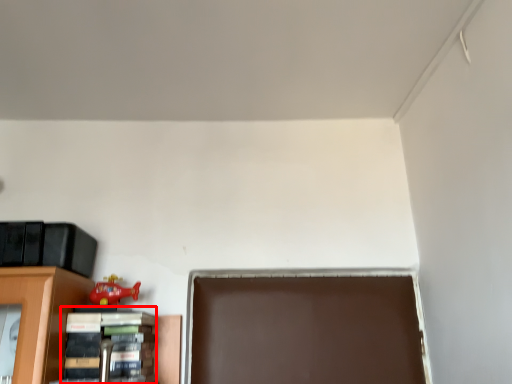
Question: From the image's perspective, where is book (annotated by the red box) located relative to toy?

Choices:
 (A) above
 (B) below

Answer: (B)